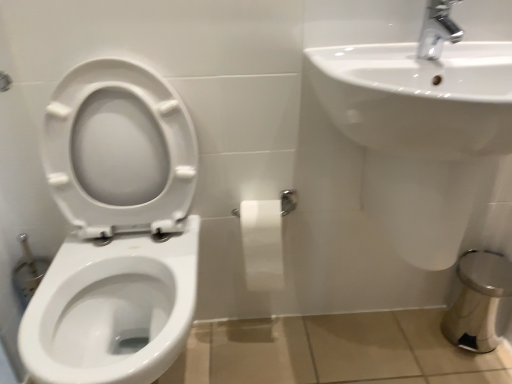
Question: Considering the positions of chrome metallic faucet at upper right and white glossy sink at upper right in the image, is chrome metallic faucet at upper right wider or thinner than white glossy sink at upper right?

Choices:
 (A) wide
 (B) thin

Answer: (B)

Question: From a real-world perspective, is chrome metallic faucet at upper right positioned above or below white glossy sink at upper right?

Choices:
 (A) below
 (B) above

Answer: (B)

Question: Estimate the real-world distances between objects in this image. Which object is farther from the chrome metallic faucet at upper right?

Choices:
 (A) white glossy toilet at left
 (B) white glossy sink at upper right
 (C) white matte toilet paper at center

Answer: (A)

Question: Which is farther from the white glossy sink at upper right?

Choices:
 (A) chrome metallic faucet at upper right
 (B) white glossy toilet at left
 (C) white matte toilet paper at center

Answer: (B)